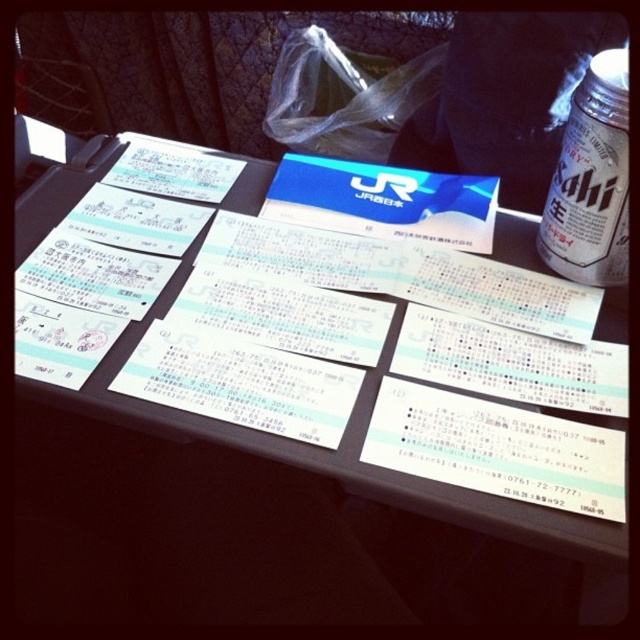
Can you confirm if white paper tickets at center is bigger than white glass bottle at upper right?

Correct, white paper tickets at center is larger in size than white glass bottle at upper right.

Find the location of `white paper tickets at center`. white paper tickets at center is located at coordinates 339,451.

Is point (70, 154) in front of point (584, 100)?

No, (70, 154) is behind (584, 100).

I want to click on white paper tickets at center, so click(x=339, y=451).